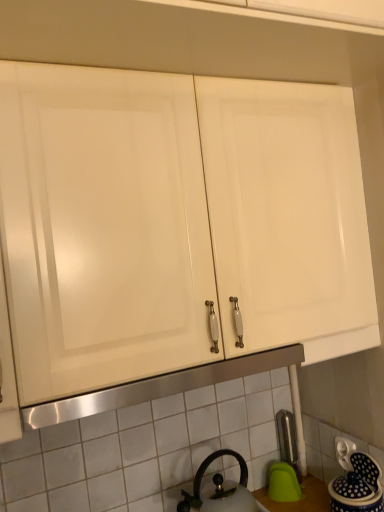
Question: Would you say white tile at center is to the left or to the right of black matte kettle at lower center in the picture?

Choices:
 (A) right
 (B) left

Answer: (B)

Question: Relative to black matte kettle at lower center, is white tile at center in front or behind?

Choices:
 (A) front
 (B) behind

Answer: (B)

Question: Considering the real-world distances, which object is closest to the black matte kettle at lower center?

Choices:
 (A) white tile at center
 (B) blue glazed ceramic jar at lower right
 (C) white plastic electric outlet at lower right
 (D) satin nickel faucet at lower right

Answer: (A)

Question: Which object is the farthest from the white tile at center?

Choices:
 (A) black matte kettle at lower center
 (B) blue glazed ceramic jar at lower right
 (C) satin nickel faucet at lower right
 (D) white plastic electric outlet at lower right

Answer: (D)